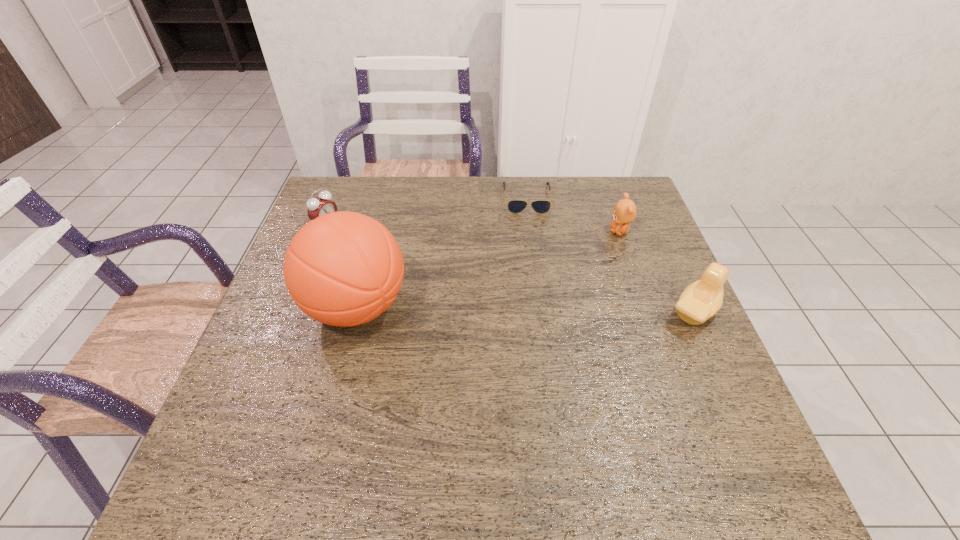
The height and width of the screenshot is (540, 960). What are the coordinates of `vacant space located on the front-facing side of the shortest object` in the screenshot? It's located at (531, 230).

Image resolution: width=960 pixels, height=540 pixels. What are the coordinates of `vacant region located on the front-facing side of the shortest object` in the screenshot? It's located at (539, 303).

Find the location of a particular element. free space located 0.200m on the front-facing side of the shortest object is located at coordinates (534, 258).

At what (x,y) coordinates should I click in order to perform the action: click on vacant space located 0.280m on the clock face of the alarm clock. Please return your answer as a coordinate pair (x, y). The width and height of the screenshot is (960, 540). Looking at the image, I should click on (408, 265).

Find the location of `free space located on the clock face of the alarm clock`. free space located on the clock face of the alarm clock is located at coordinates (372, 247).

Identify the location of free space located 0.320m on the clock face of the alarm clock. The image size is (960, 540). (420, 270).

In order to click on sunglasses positioned at the far edge in this screenshot , I will do `click(514, 206)`.

Identify the location of alarm clock that is at the far edge. The height and width of the screenshot is (540, 960). (320, 205).

Find the location of `basketball at the left edge`. basketball at the left edge is located at coordinates (343, 268).

What are the coordinates of `alarm clock that is at the left edge` in the screenshot? It's located at (320, 205).